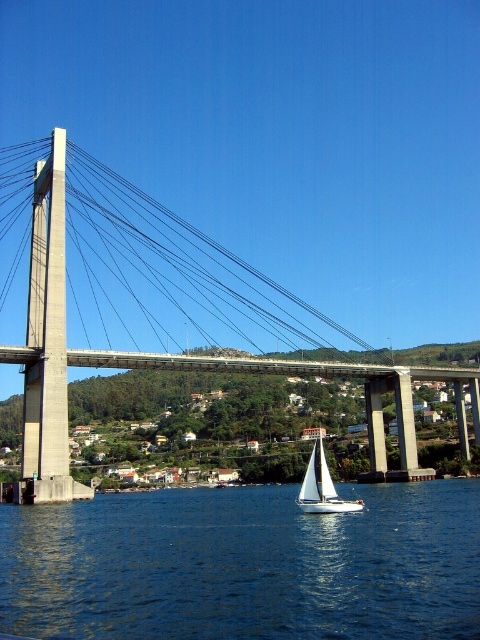
Is concrete suspension bridge at center bigger than white sailboat at center?

Indeed, concrete suspension bridge at center has a larger size compared to white sailboat at center.

How far apart are concrete suspension bridge at center and white sailboat at center?

A distance of 95.81 meters exists between concrete suspension bridge at center and white sailboat at center.

Does point (277, 310) lie behind point (299, 497)?

Yes.

This screenshot has width=480, height=640. What are the coordinates of `concrete suspension bridge at center` in the screenshot? It's located at (137, 292).

Does blue liquid water at center appear on the left side of concrete suspension bridge at center?

In fact, blue liquid water at center is to the right of concrete suspension bridge at center.

Is blue liquid water at center shorter than concrete suspension bridge at center?

Yes, blue liquid water at center is shorter than concrete suspension bridge at center.

Find the location of a particular element. The width and height of the screenshot is (480, 640). blue liquid water at center is located at coordinates (244, 564).

You are a GUI agent. You are given a task and a screenshot of the screen. Output one action in this format:
    pyautogui.click(x=<x>, y=<y>)
    Task: Click on the blue liquid water at center
    
    Given the screenshot: What is the action you would take?
    pyautogui.click(x=244, y=564)

Is blue liquid water at center wider than white sailboat at center?

Yes, blue liquid water at center is wider than white sailboat at center.

What do you see at coordinates (244, 564) in the screenshot? The image size is (480, 640). I see `blue liquid water at center` at bounding box center [244, 564].

The image size is (480, 640). Identify the location of blue liquid water at center. (244, 564).